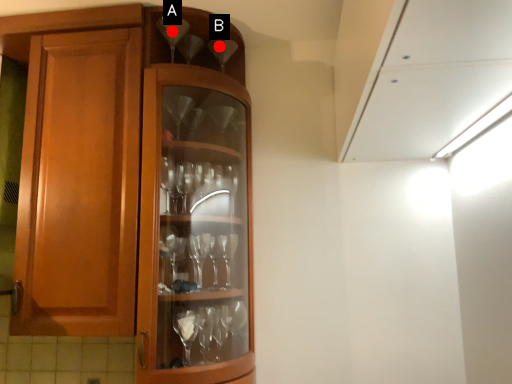
Question: Two points are circled on the image, labeled by A and B beside each circle. Which point is further to the camera?

Choices:
 (A) A is further
 (B) B is further

Answer: (B)